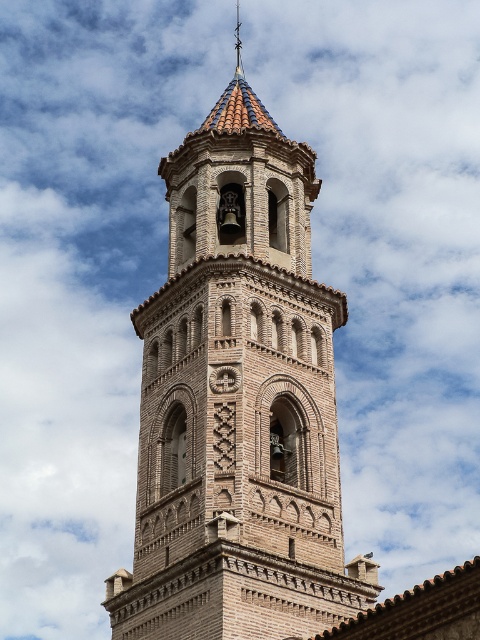
You are a photographer standing in front of the brown brick tower at center and the polished brass cross at upper center. You want to capture a photo where the cross is clearly visible above the tower. Based on their positions, will the cross be fully visible in the photo?

The brown brick tower at center is in front of the polished brass cross at upper center, so the cross may be partially or fully blocked by the tower in the photo. To ensure the cross is clearly visible above the tower, adjust your angle or position to avoid obstruction.

You are an architect designing a new bell tower and want to ensure the cross on top is visible from the ground. Given the brown brick tower at center and the polished brass cross at upper center, which object should you focus on adjusting in height to make the cross more prominent?

The brown brick tower at center is taller than polished brass cross at upper center. To make the cross more prominent, you should decrease the height of the brown brick tower at center or increase the height of the polished brass cross at upper center so that the cross stands taller than the tower.

You are an architect examining the bell tower. You notice the brown brick tower at center and the polished brass cross at upper center. Which object is positioned higher in the image?

The polished brass cross at upper center is positioned higher than the brown brick tower at center.